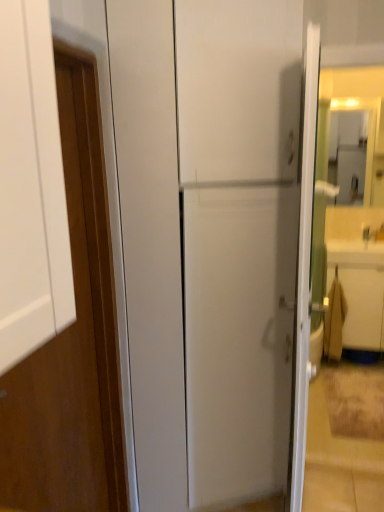
The height and width of the screenshot is (512, 384). What are the coordinates of `wooden door at left` in the screenshot? It's located at (71, 341).

What is the approximate width of wooden door at left?

It is 4.10 inches.

The width and height of the screenshot is (384, 512). What do you see at coordinates (71, 341) in the screenshot?
I see `wooden door at left` at bounding box center [71, 341].

The width and height of the screenshot is (384, 512). Find the location of `beige fabric drawer at right`. beige fabric drawer at right is located at coordinates (363, 307).

Measure the distance between point (360, 338) and camera.

Result: A distance of 3.23 meters exists between point (360, 338) and camera.

Measure the distance between beige fabric drawer at right and camera.

beige fabric drawer at right and camera are 3.07 meters apart.

What do you see at coordinates (363, 307) in the screenshot? The width and height of the screenshot is (384, 512). I see `beige fabric drawer at right` at bounding box center [363, 307].

This screenshot has height=512, width=384. Identify the location of wooden door at left. (71, 341).

Considering the positions of objects beige fabric drawer at right and wooden door at left in the image provided, who is more to the left, beige fabric drawer at right or wooden door at left?

Positioned to the left is wooden door at left.

Is beige fabric drawer at right in front of or behind wooden door at left in the image?

Clearly, beige fabric drawer at right is behind wooden door at left.

Is point (368, 290) closer to camera compared to point (74, 480)?

No, it is behind (74, 480).

From the image's perspective, is beige fabric drawer at right above wooden door at left?

No.

From a real-world perspective, is beige fabric drawer at right positioned under wooden door at left based on gravity?

Yes, from a real-world perspective, beige fabric drawer at right is beneath wooden door at left.

Is beige fabric drawer at right wider than wooden door at left?

Indeed, beige fabric drawer at right has a greater width compared to wooden door at left.

Considering the relative sizes of beige fabric drawer at right and wooden door at left in the image provided, is beige fabric drawer at right shorter than wooden door at left?

Yes.

Is beige fabric drawer at right bigger than wooden door at left?

Yes.

Choose the correct answer: Is beige fabric drawer at right inside wooden door at left or outside it?

beige fabric drawer at right is spatially situated outside wooden door at left.

Is beige fabric drawer at right directly adjacent to wooden door at left?

beige fabric drawer at right and wooden door at left are clearly separated.

Looking at this image, is beige fabric drawer at right facing away from wooden door at left?

No, beige fabric drawer at right is not facing away from wooden door at left.

Looking at this image, measure the distance between beige fabric drawer at right and wooden door at left.

They are 2.10 meters apart.

At what (x,y) coordinates should I click in order to perform the action: click on door located on the left of beige fabric drawer at right. Please return your answer as a coordinate pair (x, y). The image size is (384, 512). Looking at the image, I should click on (71, 341).

Can you confirm if wooden door at left is positioned to the right of beige fabric drawer at right?

No.

Considering their positions, is wooden door at left located in front of or behind beige fabric drawer at right?

wooden door at left is in front of beige fabric drawer at right.

Which point is more forward, (42, 348) or (343, 265)?

The point (42, 348) is more forward.

From the image's perspective, is wooden door at left above or below beige fabric drawer at right?

Based on their image positions, wooden door at left is located above beige fabric drawer at right.

From a real-world perspective, who is located higher, wooden door at left or beige fabric drawer at right?

wooden door at left is physically above.

In terms of width, does wooden door at left look wider or thinner when compared to beige fabric drawer at right?

Clearly, wooden door at left has less width compared to beige fabric drawer at right.

Which of these two, wooden door at left or beige fabric drawer at right, stands shorter?

beige fabric drawer at right is shorter.

Is wooden door at left smaller than beige fabric drawer at right?

Correct, wooden door at left occupies less space than beige fabric drawer at right.

Do you think wooden door at left is within beige fabric drawer at right, or outside of it?

wooden door at left is not enclosed by beige fabric drawer at right.

Is wooden door at left beside beige fabric drawer at right?

wooden door at left and beige fabric drawer at right are not in contact.

Is wooden door at left oriented away from beige fabric drawer at right?

No, wooden door at left is not facing away from beige fabric drawer at right.

Can you tell me how much wooden door at left and beige fabric drawer at right differ in facing direction?

92.6 degrees.

Find the location of a particular element. The width and height of the screenshot is (384, 512). drawer on the right of the wooden door at left is located at coordinates (363, 307).

The image size is (384, 512). In order to click on door above the beige fabric drawer at right (from the image's perspective) in this screenshot , I will do `click(71, 341)`.

In order to click on drawer behind the wooden door at left in this screenshot , I will do `click(363, 307)`.